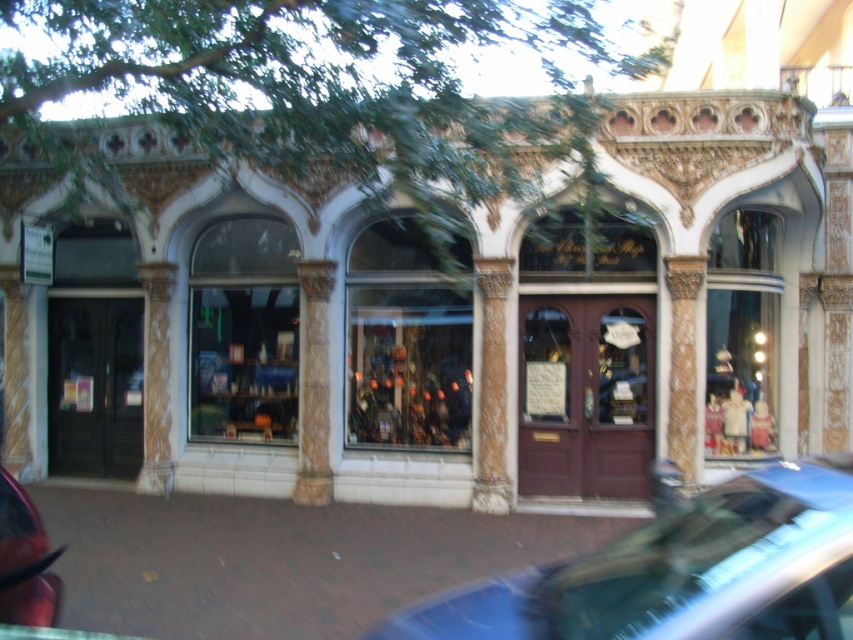
Which is more to the right, translucent glass ornaments at center or shiny red car at lower left?

Positioned to the right is translucent glass ornaments at center.

Can you confirm if translucent glass ornaments at center is taller than shiny red car at lower left?

Indeed, translucent glass ornaments at center has a greater height compared to shiny red car at lower left.

Between point (463, 428) and point (22, 522), which one is positioned in front?

Point (22, 522) is more forward.

Image resolution: width=853 pixels, height=640 pixels. Identify the location of translucent glass ornaments at center. 408,365.

Is white stone storefront at center to the right of translucent glass ornaments at center from the viewer's perspective?

In fact, white stone storefront at center is to the left of translucent glass ornaments at center.

Who is taller, white stone storefront at center or translucent glass ornaments at center?

Standing taller between the two is translucent glass ornaments at center.

Does point (479, 497) come in front of point (421, 321)?

Yes, it is.

You are a GUI agent. You are given a task and a screenshot of the screen. Output one action in this format:
    pyautogui.click(x=<x>, y=<y>)
    Task: Click on the white stone storefront at center
    The height and width of the screenshot is (640, 853).
    Given the screenshot: What is the action you would take?
    pyautogui.click(x=451, y=328)

Can you confirm if metallic blue car at lower right is positioned above translucent glass ornaments at center?

No.

Which is below, metallic blue car at lower right or translucent glass ornaments at center?

Positioned lower is metallic blue car at lower right.

Find the location of a particular element. The width and height of the screenshot is (853, 640). metallic blue car at lower right is located at coordinates (680, 572).

At what (x,y) coordinates should I click in order to perform the action: click on metallic blue car at lower right. Please return your answer as a coordinate pair (x, y). This screenshot has height=640, width=853. Looking at the image, I should click on (680, 572).